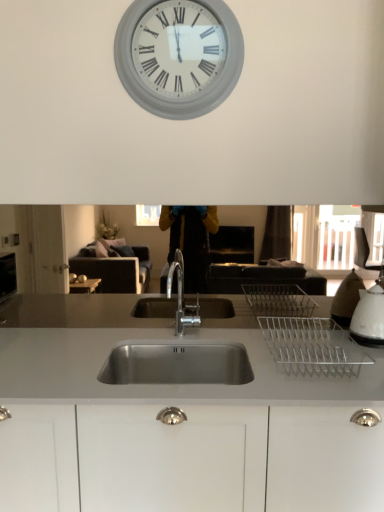
Identify the location of vacant area on top of stainless steel sink at center (from a real-world perspective). Image resolution: width=384 pixels, height=512 pixels. tap(170, 340).